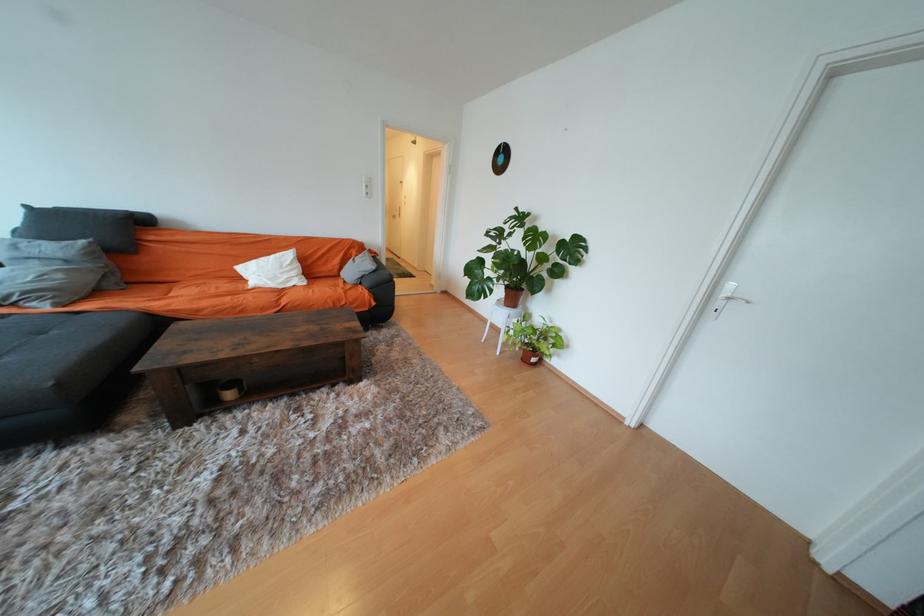
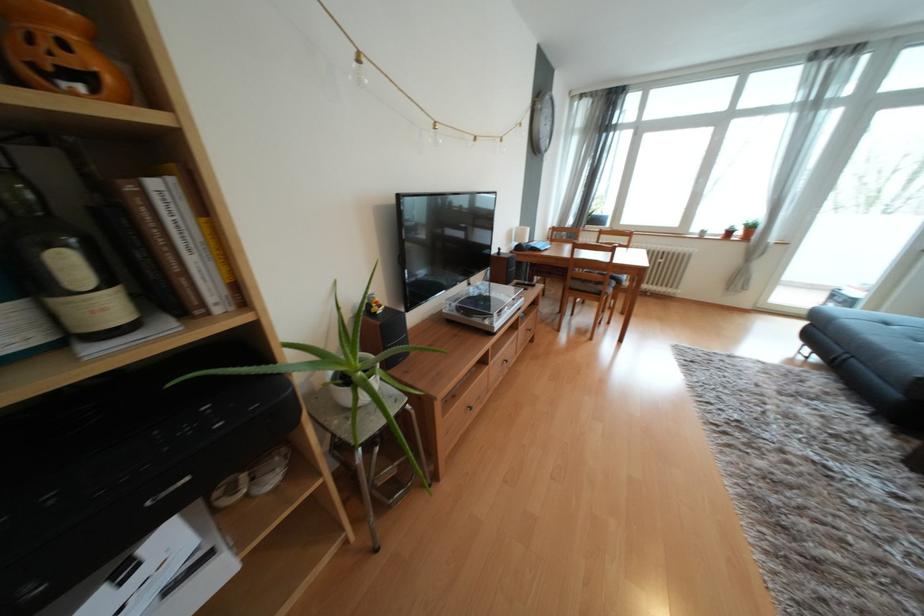
Locate, in the second image, the point that corresponds to the point at 154,560 in the first image.

(745, 424)